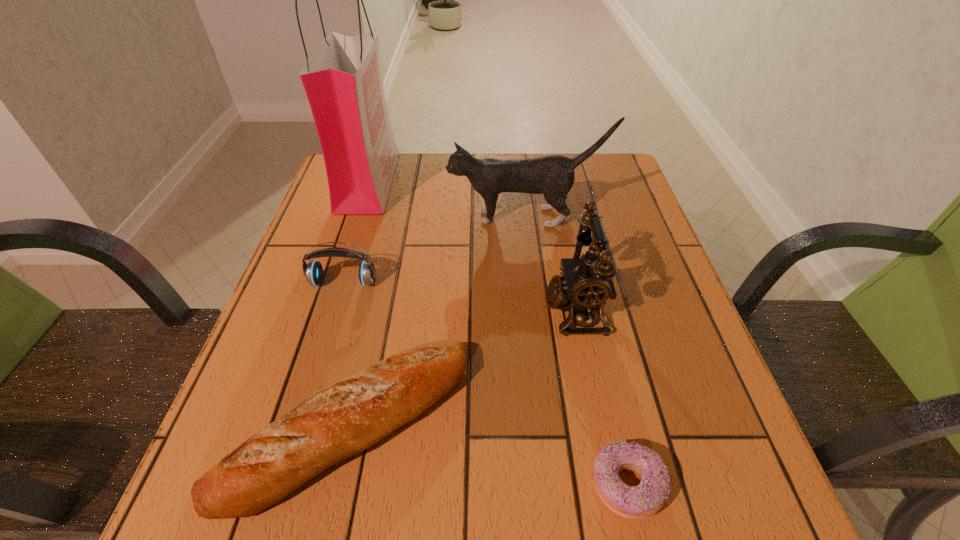
Where is `free space between the fifth shortest object and the baguet`? The height and width of the screenshot is (540, 960). free space between the fifth shortest object and the baguet is located at coordinates (438, 322).

Where is `free space between the shortest object and the tallest object`? The image size is (960, 540). free space between the shortest object and the tallest object is located at coordinates (497, 333).

Where is `object that is the fourth nearest to the fifth shortest object`? The image size is (960, 540). object that is the fourth nearest to the fifth shortest object is located at coordinates (341, 420).

Select which object is the fifth closest to the second tallest object. Please provide its 2D coordinates. Your answer should be formatted as a tuple, i.e. [(x, y)], where the tuple contains the x and y coordinates of a point satisfying the conditions above.

[(638, 502)]

You are a GUI agent. You are given a task and a screenshot of the screen. Output one action in this format:
    pyautogui.click(x=<x>, y=<y>)
    Task: Click on the free location that satisfies the following two spatial constraints: 1. on the front-facing side of the shopping bag; 2. on the left side of the second shortest object
    This screenshot has height=540, width=960.
    Given the screenshot: What is the action you would take?
    pyautogui.click(x=290, y=426)

Image resolution: width=960 pixels, height=540 pixels. Identify the location of free space that satisfies the following two spatial constraints: 1. at the face of the shortest object; 2. on the right side of the cat. (557, 485).

I want to click on free space in the image that satisfies the following two spatial constraints: 1. on the rotary dial of the shortest object; 2. on the left side of the telephone, so click(x=610, y=485).

At what (x,y) coordinates should I click in order to perform the action: click on free spot that satisfies the following two spatial constraints: 1. on the ear cups of the third shortest object; 2. on the left side of the fifth tallest object. Please return your answer as a coordinate pair (x, y). The image size is (960, 540). Looking at the image, I should click on (300, 426).

Find the location of a particular element. The image size is (960, 540). vacant space that satisfies the following two spatial constraints: 1. on the front-facing side of the shopping bag; 2. on the left side of the second shortest object is located at coordinates (290, 426).

Image resolution: width=960 pixels, height=540 pixels. Find the location of `vacant position in the image that satisfies the following two spatial constraints: 1. at the face of the second tallest object; 2. on the ear cups of the headset`. vacant position in the image that satisfies the following two spatial constraints: 1. at the face of the second tallest object; 2. on the ear cups of the headset is located at coordinates pos(533,282).